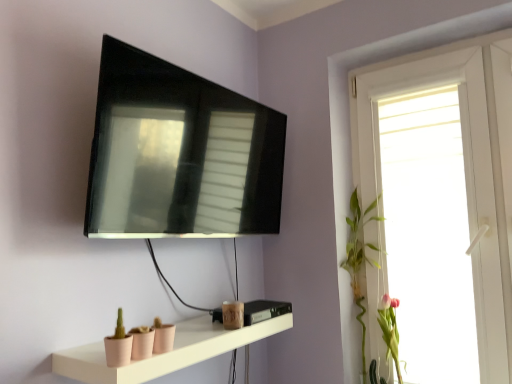
Measure the distance between point (213,105) and camera.

Point (213,105) and camera are 4.72 feet apart from each other.

This screenshot has height=384, width=512. Describe the element at coordinates (165, 353) in the screenshot. I see `matte pink shelf at lower center` at that location.

Locate an element on the screen. This screenshot has width=512, height=384. pink matte flower at right, positioned as the 1th plant in right-to-left order is located at coordinates (390, 329).

What is the approximate width of pink matte flower at right, positioned as the 1th plant in right-to-left order?

pink matte flower at right, positioned as the 1th plant in right-to-left order, is 4.28 inches in width.

Measure the distance between point (x=421, y=68) and camera.

1.71 meters.

Where is `matte black tv at upper center`? This screenshot has width=512, height=384. matte black tv at upper center is located at coordinates (179, 153).

Considering the sizes of green leafy plant at right, which is the second plant from right to left, and white glossy window at upper right in the image, is green leafy plant at right, which is the second plant from right to left, taller or shorter than white glossy window at upper right?

In the image, green leafy plant at right, which is the second plant from right to left, appears to be shorter than white glossy window at upper right.

From a real-world perspective, which object rests below the other?

green leafy plant at right, the 1th plant viewed from the left, from a real-world perspective.

Between green leafy plant at right, the 1th plant viewed from the left, and white glossy window at upper right, which one appears on the left side from the viewer's perspective?

From the viewer's perspective, green leafy plant at right, the 1th plant viewed from the left, appears more on the left side.

Does point (396, 298) come farther from viewer compared to point (374, 144)?

No, it is not.

From the image's perspective, who appears lower, matte black tv at upper center or white glossy window at upper right?

white glossy window at upper right is shown below in the image.

In the scene shown: How far apart are matte black tv at upper center and white glossy window at upper right?

They are 28.88 inches apart.

From a real-world perspective, does matte black tv at upper center sit lower than white glossy window at upper right?

No, from a real-world perspective, matte black tv at upper center is not under white glossy window at upper right.

Is matte black tv at upper center next to white glossy window at upper right and touching it?

No, matte black tv at upper center is not beside white glossy window at upper right.

Is matte black tv at upper center a part of pink matte flower at right, positioned as the 1th plant in right-to-left order?

No, matte black tv at upper center is not a part of pink matte flower at right, positioned as the 1th plant in right-to-left order.

Locate an element on the screen. The image size is (512, 384). television in front of the pink matte flower at right, positioned as the second plant in left-to-right order is located at coordinates click(179, 153).

Based on the photo, does pink matte flower at right, positioned as the 1th plant in right-to-left order, come behind matte black tv at upper center?

Yes, it is behind matte black tv at upper center.

From a real-world perspective, is matte pink shelf at lower center below pink matte flower at right, positioned as the 1th plant in right-to-left order?

No, from a real-world perspective, matte pink shelf at lower center is not below pink matte flower at right, positioned as the 1th plant in right-to-left order.

Considering the sizes of objects matte pink shelf at lower center and pink matte flower at right, positioned as the second plant in left-to-right order, in the image provided, who is wider, matte pink shelf at lower center or pink matte flower at right, positioned as the second plant in left-to-right order,?

matte pink shelf at lower center.

Considering the relative sizes of matte pink shelf at lower center and pink matte flower at right, positioned as the second plant in left-to-right order, in the image provided, is matte pink shelf at lower center taller than pink matte flower at right, positioned as the second plant in left-to-right order,?

In fact, matte pink shelf at lower center may be shorter than pink matte flower at right, positioned as the second plant in left-to-right order.

From the image's perspective, between matte pink shelf at lower center and pink matte flower at right, positioned as the second plant in left-to-right order, who is located below?

pink matte flower at right, positioned as the second plant in left-to-right order, from the image's perspective.

From a real-world perspective, who is located lower, white glossy window at upper right or green leafy plant at right, which is the second plant from right to left?

green leafy plant at right, which is the second plant from right to left, is physically lower.

Is white glossy window at upper right aimed at green leafy plant at right, the 1th plant viewed from the left?

Yes, white glossy window at upper right is facing green leafy plant at right, the 1th plant viewed from the left.

Is the depth of white glossy window at upper right greater than that of green leafy plant at right, the 1th plant viewed from the left?

No.

Considering the relative sizes of white glossy window at upper right and green leafy plant at right, the 1th plant viewed from the left, in the image provided, is white glossy window at upper right thinner than green leafy plant at right, the 1th plant viewed from the left,?

Correct, the width of white glossy window at upper right is less than that of green leafy plant at right, the 1th plant viewed from the left.

Consider the image. Is matte pink shelf at lower center positioned far away from matte black tv at upper center?

They are positioned close to each other.

Is matte pink shelf at lower center not within matte black tv at upper center?

Indeed, matte pink shelf at lower center is completely outside matte black tv at upper center.

Identify the location of shelf that is below the matte black tv at upper center (from the image's perspective). This screenshot has height=384, width=512. (165, 353).

From the image's perspective, is matte black tv at upper center under matte pink shelf at lower center?

No, from the image's perspective, matte black tv at upper center is not below matte pink shelf at lower center.

Is matte black tv at upper center shorter than matte pink shelf at lower center?

In fact, matte black tv at upper center may be taller than matte pink shelf at lower center.

Which point is more distant from viewer, (152, 165) or (102, 345)?

The point (152, 165) is farther from the camera.

Locate an element on the screen. Image resolution: width=512 pixels, height=384 pixels. shelf in front of the matte black tv at upper center is located at coordinates (165, 353).

Image resolution: width=512 pixels, height=384 pixels. I want to click on window above the green leafy plant at right, the 1th plant viewed from the left (from a real-world perspective), so click(x=464, y=165).

Identify the location of television lying on the left of white glossy window at upper right. (179, 153).

Which object lies nearer to the anchor point matte pink shelf at lower center, pink matte flower at right, positioned as the 1th plant in right-to-left order, or green leafy plant at right, which is the second plant from right to left?

Among the two, green leafy plant at right, which is the second plant from right to left, is located nearer to matte pink shelf at lower center.

Which object lies further to the anchor point matte pink shelf at lower center, matte black tv at upper center or pink matte flower at right, positioned as the second plant in left-to-right order?

Among the two, pink matte flower at right, positioned as the second plant in left-to-right order, is located further to matte pink shelf at lower center.

Looking at the image, which one is located closer to green leafy plant at right, the 1th plant viewed from the left, matte pink shelf at lower center or matte black tv at upper center?

matte pink shelf at lower center.

When comparing their distances from white glossy window at upper right, does pink matte flower at right, positioned as the second plant in left-to-right order, or matte black tv at upper center seem closer?

pink matte flower at right, positioned as the second plant in left-to-right order, is closer to white glossy window at upper right.

Which object lies further to the anchor point matte black tv at upper center, green leafy plant at right, which is the second plant from right to left, or pink matte flower at right, positioned as the second plant in left-to-right order?

pink matte flower at right, positioned as the second plant in left-to-right order, is further to matte black tv at upper center.

When comparing their distances from white glossy window at upper right, does green leafy plant at right, the 1th plant viewed from the left, or matte black tv at upper center seem further?

matte black tv at upper center.

Which object lies nearer to the anchor point white glossy window at upper right, pink matte flower at right, positioned as the second plant in left-to-right order, or matte pink shelf at lower center?

pink matte flower at right, positioned as the second plant in left-to-right order, lies closer to white glossy window at upper right than the other object.

Which object lies further to the anchor point white glossy window at upper right, green leafy plant at right, the 1th plant viewed from the left, or matte pink shelf at lower center?

matte pink shelf at lower center is positioned further to the anchor white glossy window at upper right.

Where is `television between matte pink shelf at lower center and white glossy window at upper right from left to right`? The image size is (512, 384). television between matte pink shelf at lower center and white glossy window at upper right from left to right is located at coordinates (179, 153).

What are the coordinates of `television situated between matte pink shelf at lower center and pink matte flower at right, positioned as the second plant in left-to-right order, from left to right` in the screenshot? It's located at [179, 153].

Locate an element on the screen. The width and height of the screenshot is (512, 384). plant situated between matte pink shelf at lower center and pink matte flower at right, positioned as the second plant in left-to-right order, from left to right is located at coordinates (360, 258).

Find the location of a particular element. The width and height of the screenshot is (512, 384). plant between matte black tv at upper center and pink matte flower at right, positioned as the 1th plant in right-to-left order, in the vertical direction is located at coordinates (360, 258).